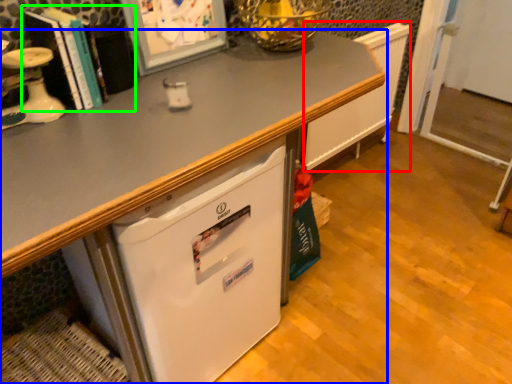
Question: Which is farther away from radiator (highlighted by a red box)? desk (highlighted by a blue box) or book (highlighted by a green box)?

Choices:
 (A) desk
 (B) book

Answer: (B)